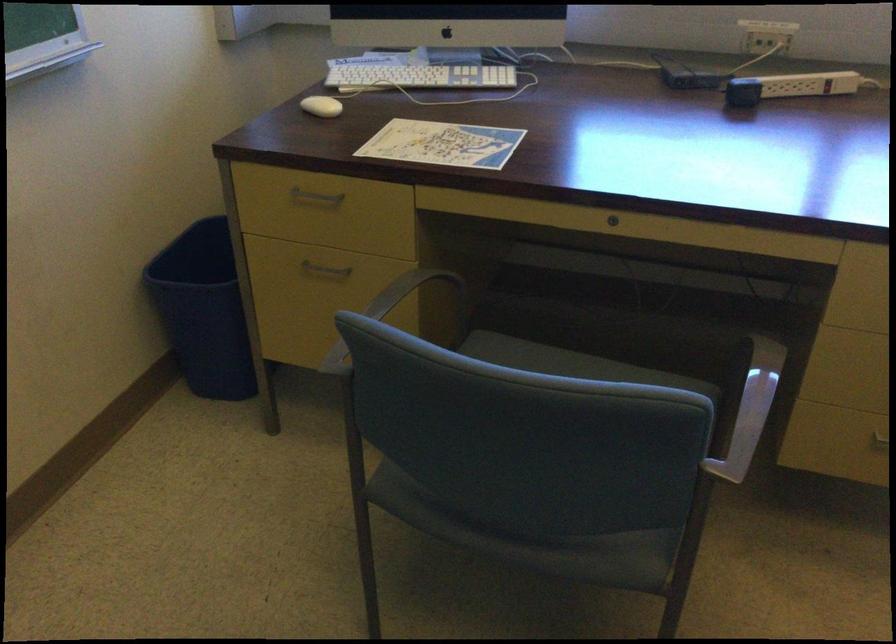
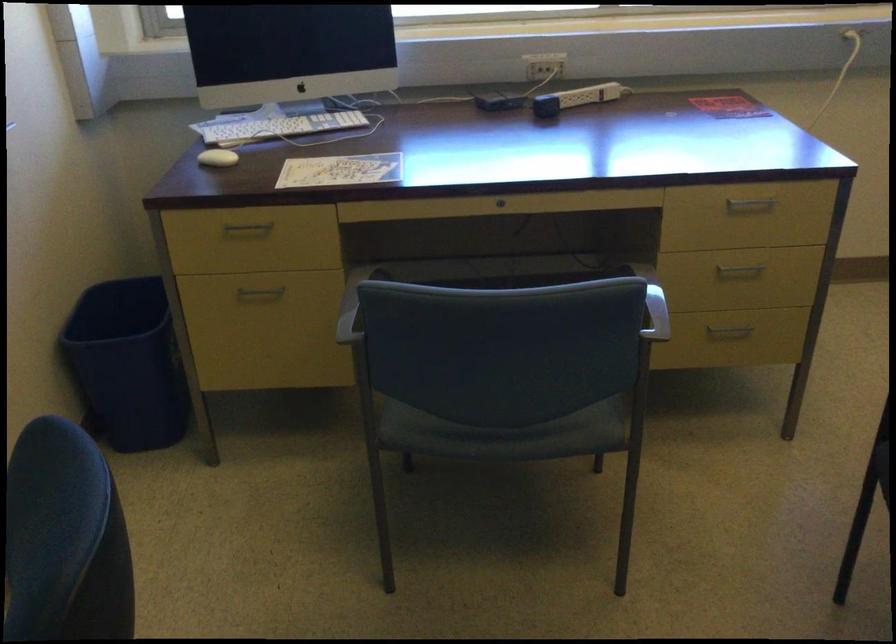
What movement of the cameraman would produce the second image?

The cameraman moved toward left, backward.